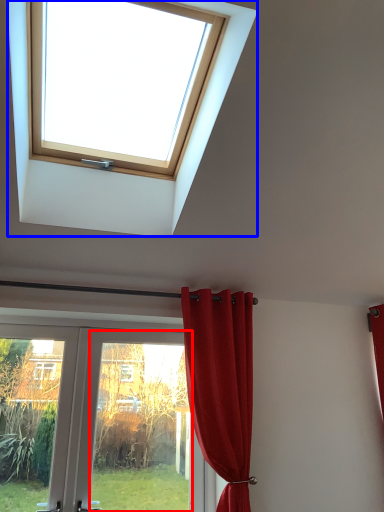
Question: Which of the following is the farthest to the observer, glass door (highlighted by a red box) or window (highlighted by a blue box)?

Choices:
 (A) glass door
 (B) window

Answer: (A)